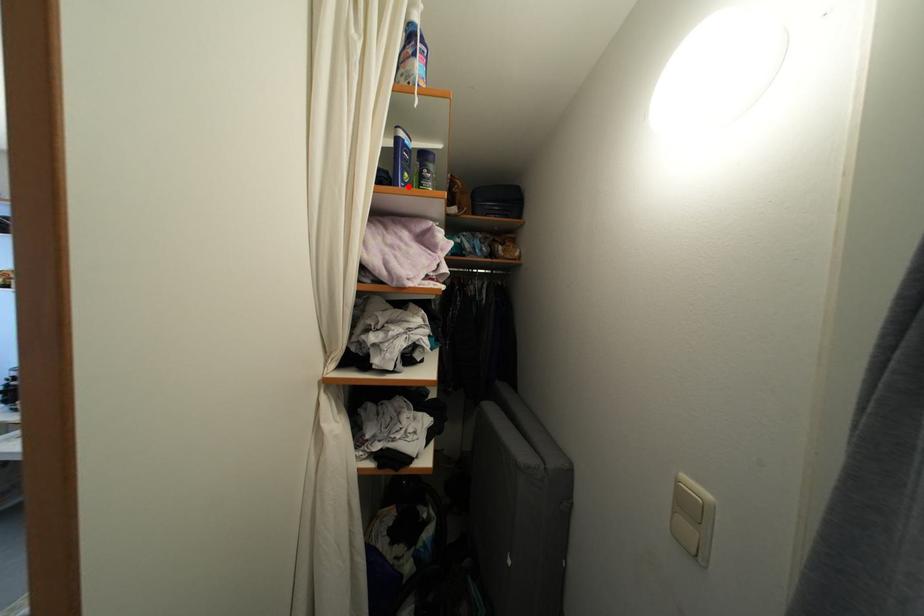
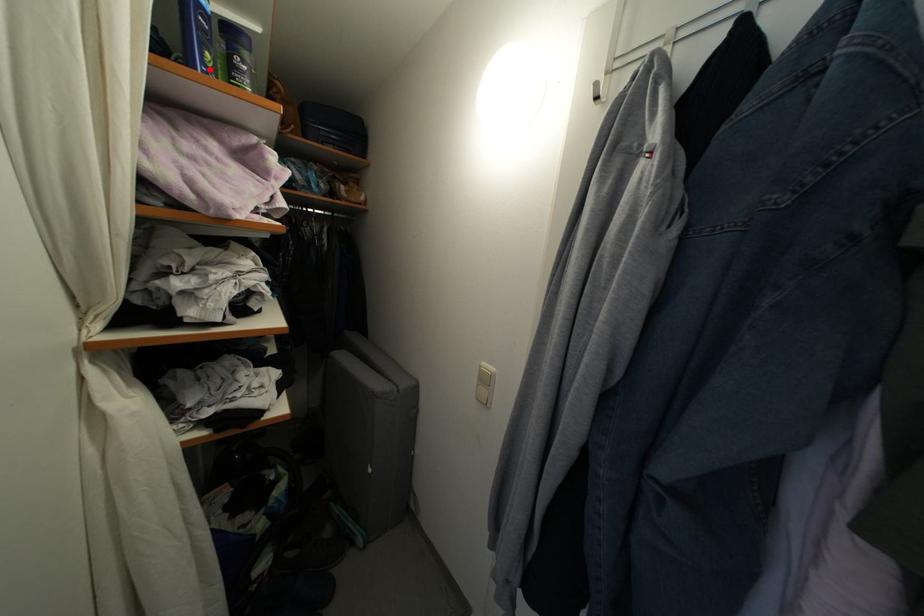
I am providing you with two images of the same scene from different viewpoints. A red point is marked on the first image and another point is marked on the second image. Do the highlighted points in image1 and image2 indicate the same real-world spot?

Yes